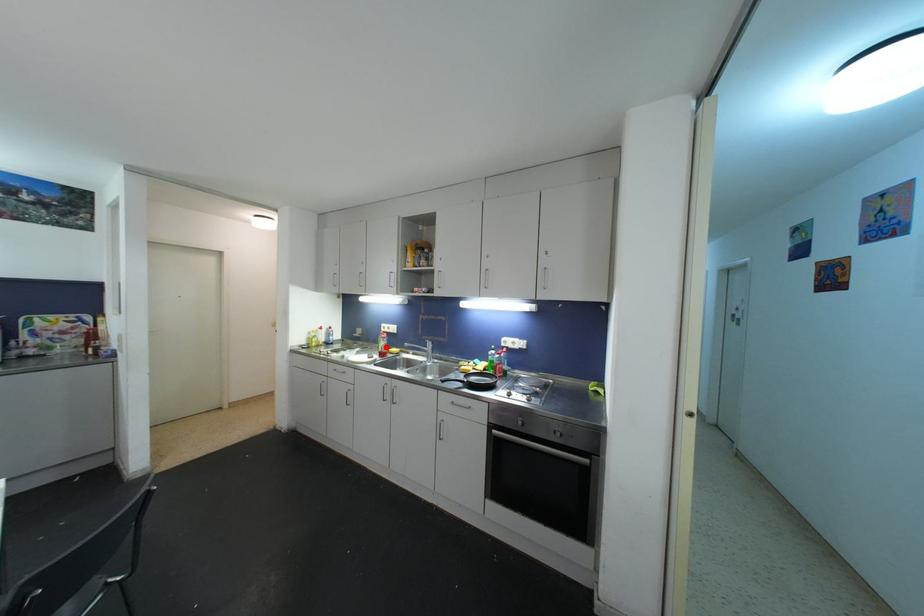
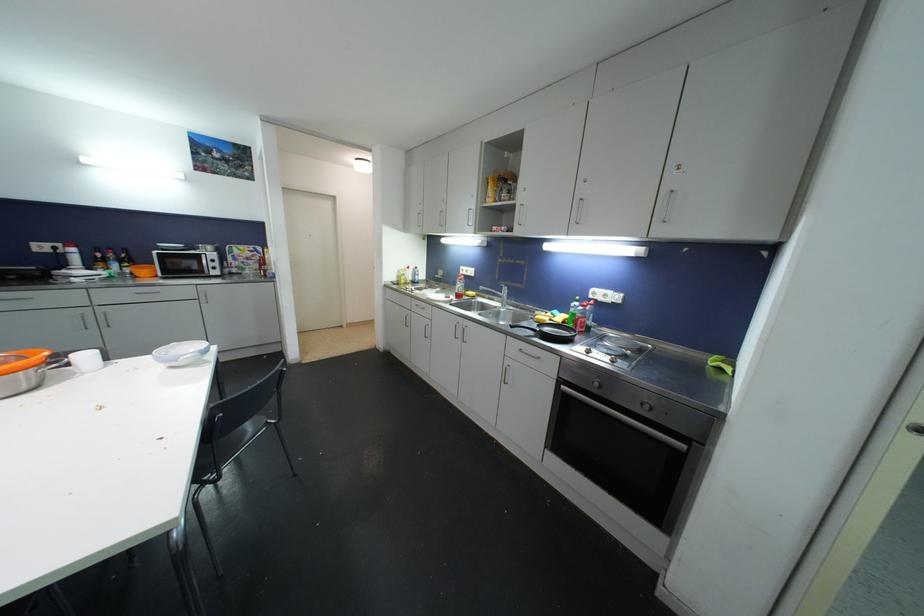
Question: I am providing you with two images of the same scene from different viewpoints. A red point is shown in image1. For the corresponding object point in image2, is it positioned nearer or farther from the camera?

Choices:
 (A) Nearer
 (B) Farther

Answer: (A)